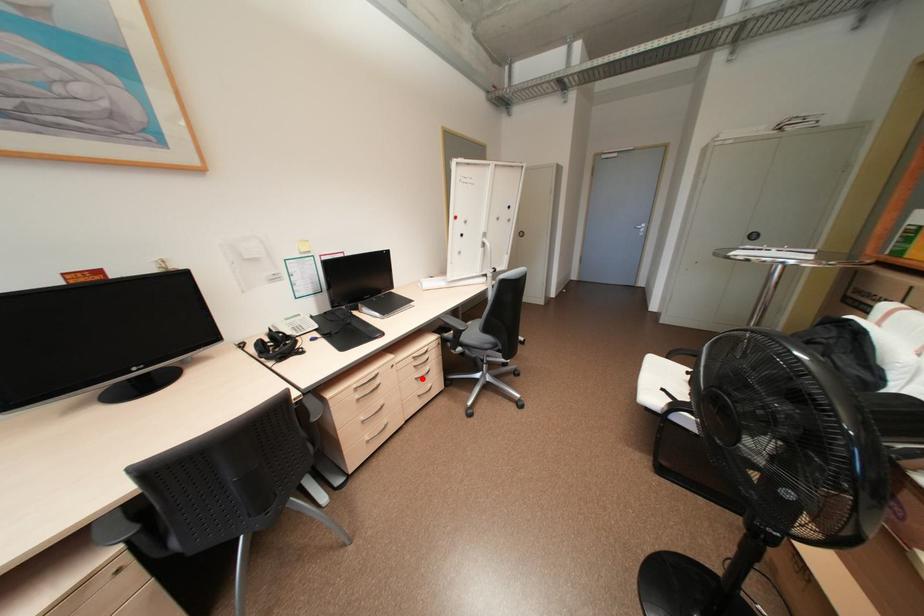
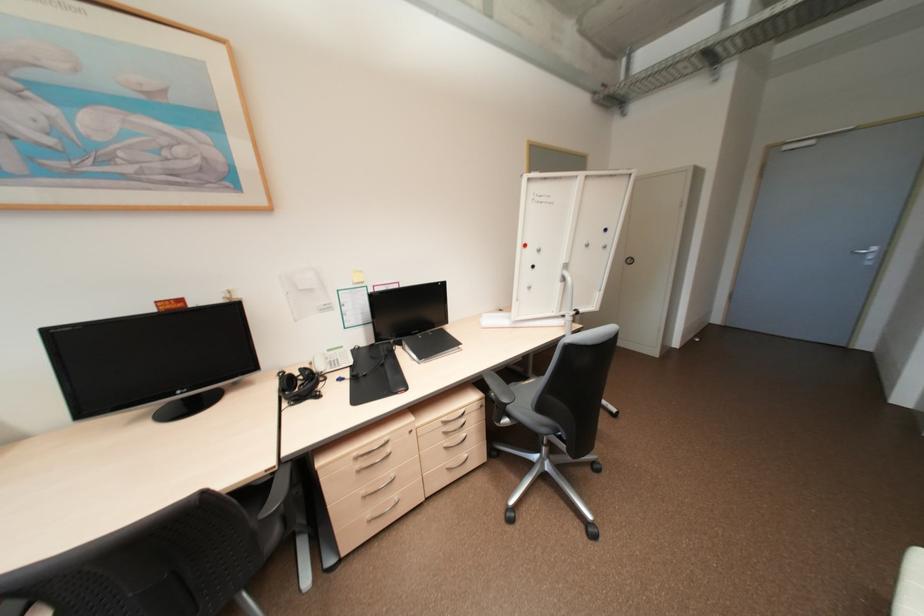
In the second image, find the point that corresponds to the highlighted location in the first image.

(451, 447)